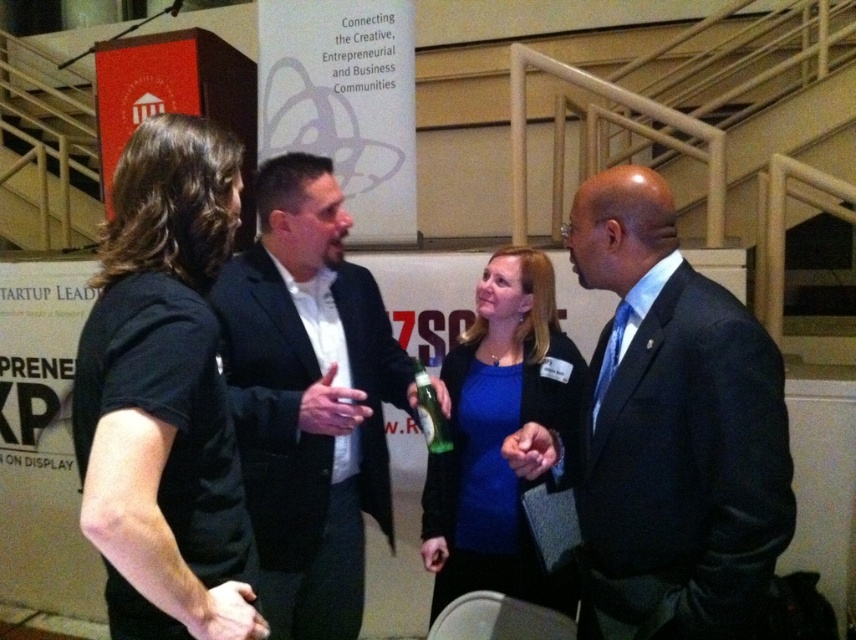
Question: Where is dark blue suit at center located in relation to green glass bottle at center in the image?

Choices:
 (A) left
 (B) right

Answer: (B)

Question: Estimate the real-world distances between objects in this image. Which object is closer to the matte black shirt at center?

Choices:
 (A) green glass bottle at center
 (B) dark suit jacket at center

Answer: (B)

Question: Is dark suit jacket at center to the left of green glass bottle at center from the viewer's perspective?

Choices:
 (A) yes
 (B) no

Answer: (A)

Question: Among these points, which one is nearest to the camera?

Choices:
 (A) (496, 300)
 (B) (709, 442)
 (C) (428, 438)
 (D) (117, 548)

Answer: (D)

Question: Can you confirm if dark blue suit at center is positioned to the left of green glass bottle at center?

Choices:
 (A) no
 (B) yes

Answer: (A)

Question: Considering the real-world distances, which object is closest to the green glass bottle at center?

Choices:
 (A) dark suit jacket at center
 (B) dark blue suit at center
 (C) matte black shirt at center

Answer: (A)